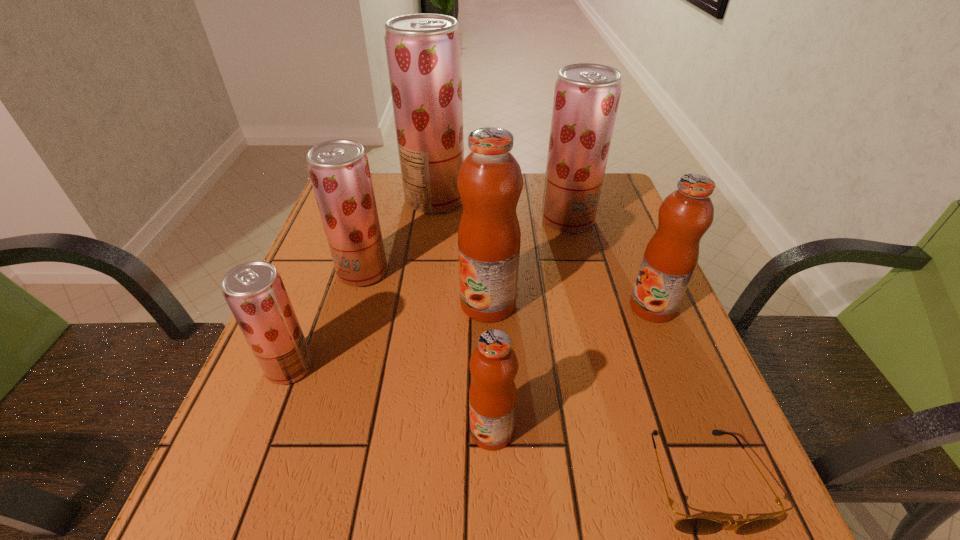
The image size is (960, 540). I want to click on the smallest orange fruit juice, so click(x=493, y=364).

You are a GUI agent. You are given a task and a screenshot of the screen. Output one action in this format:
    pyautogui.click(x=<x>, y=<y>)
    Task: Click on the nearest orange fruit juice
    
    Given the screenshot: What is the action you would take?
    pyautogui.click(x=493, y=364)

The image size is (960, 540). What are the coordinates of `black sunglasses` in the screenshot? It's located at (693, 525).

The image size is (960, 540). Identify the location of sunglasses. (693, 525).

Locate an element on the screen. vacant space located on the front of the tallest object is located at coordinates (424, 276).

Identify the location of vacant space located on the left of the second biggest strawberry fruit juice. (439, 220).

This screenshot has height=540, width=960. I want to click on vacant region located 0.050m on the front label of the biggest orange fruit juice, so click(x=437, y=303).

Find the location of a particular element. free space located on the front label of the biggest orange fruit juice is located at coordinates (399, 303).

Find the location of a particular element. This screenshot has height=540, width=960. vacant region located 0.260m on the front label of the biggest orange fruit juice is located at coordinates (338, 303).

Identify the location of free location located 0.090m on the back of the third farthest strawberry fruit juice. (374, 234).